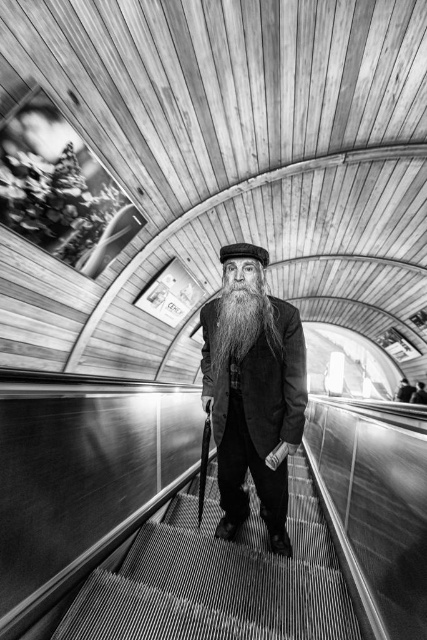
Question: Which of these objects is positioned closest to the black felt hat at center?

Choices:
 (A) smooth black coat at center
 (B) long white beard at center
 (C) metallic escalator steps at center

Answer: (B)

Question: Does smooth black coat at center appear on the right side of black felt hat at center?

Choices:
 (A) yes
 (B) no

Answer: (A)

Question: Which point is closer to the camera?

Choices:
 (A) metallic escalator steps at center
 (B) black felt hat at center
 (C) smooth black coat at center

Answer: (A)

Question: Among these objects, which one is farthest from the camera?

Choices:
 (A) metallic escalator steps at center
 (B) smooth black coat at center
 (C) long white beard at center

Answer: (B)

Question: Is metallic escalator steps at center to the left of black felt hat at center from the viewer's perspective?

Choices:
 (A) yes
 (B) no

Answer: (B)

Question: Is smooth black coat at center wider than black felt hat at center?

Choices:
 (A) yes
 (B) no

Answer: (A)